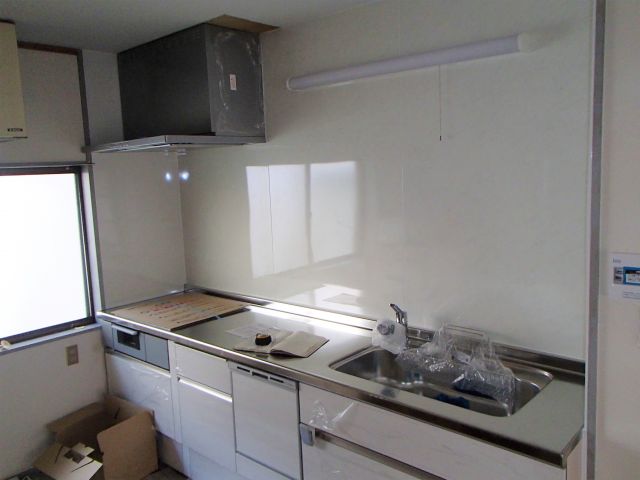
This screenshot has height=480, width=640. I want to click on book, so click(x=292, y=338).